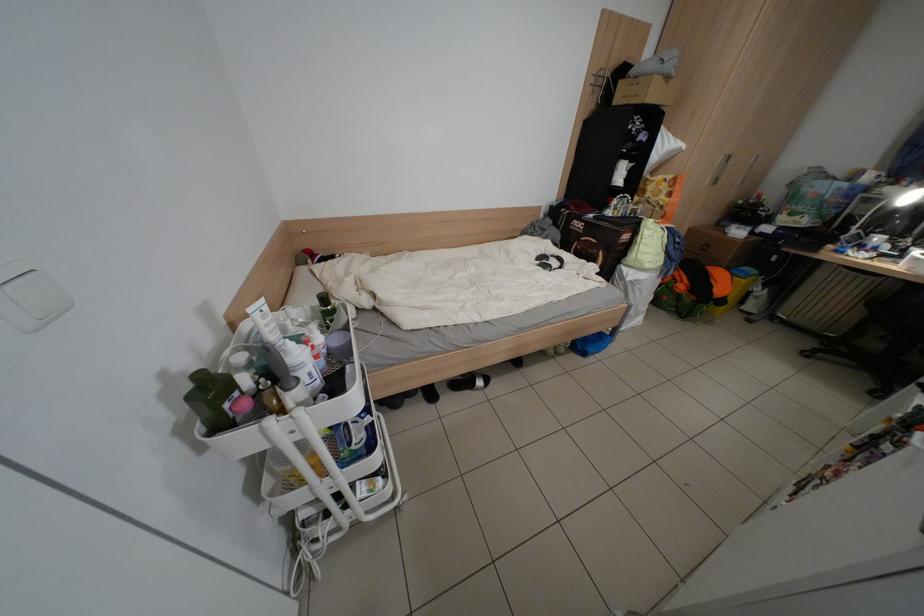
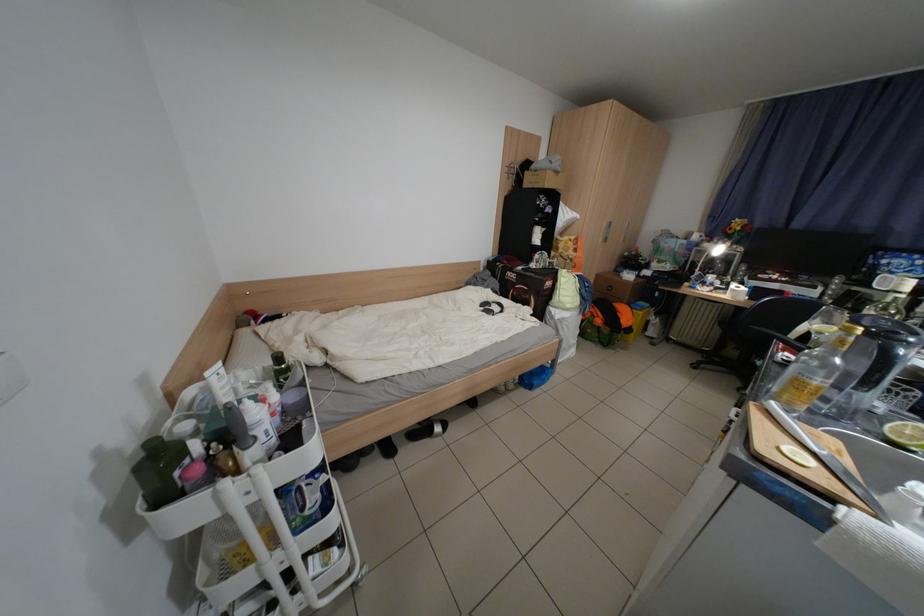
Find the pixel in the second image that matches (x=550, y=264) in the first image.

(493, 310)